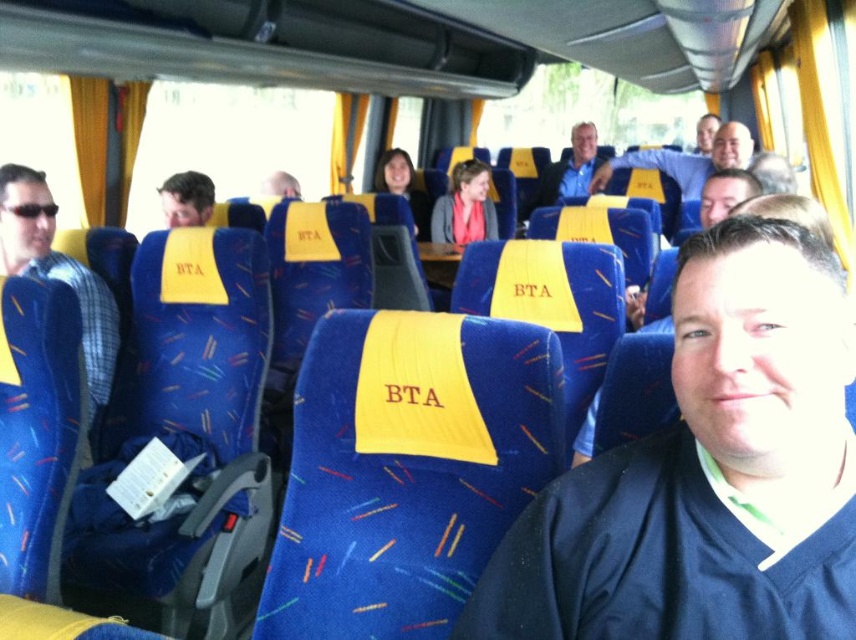
Does matte blue shirt at lower right appear over matte yellow seat at center?

Incorrect, matte blue shirt at lower right is not positioned above matte yellow seat at center.

What do you see at coordinates (706, 474) in the screenshot? The image size is (856, 640). I see `matte blue shirt at lower right` at bounding box center [706, 474].

Image resolution: width=856 pixels, height=640 pixels. In order to click on matte blue shirt at lower right in this screenshot , I will do `click(706, 474)`.

Is point (551, 189) positioned after point (383, 172)?

Yes, it is.

Locate an element on the screen. This screenshot has height=640, width=856. blue fabric seat at center is located at coordinates (568, 170).

Identify the location of blue fabric seat at center. This screenshot has width=856, height=640. (568, 170).

Is blue fabric seat at center wider than matte black hair at upper center?

Correct, the width of blue fabric seat at center exceeds that of matte black hair at upper center.

The image size is (856, 640). I want to click on blue fabric seat at center, so click(568, 170).